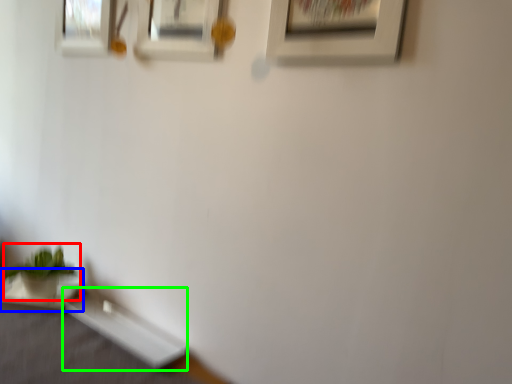
Question: Which is farther away from houseplant (highlighted by a red box)? table (highlighted by a blue box) or table (highlighted by a green box)?

Choices:
 (A) table
 (B) table

Answer: (B)